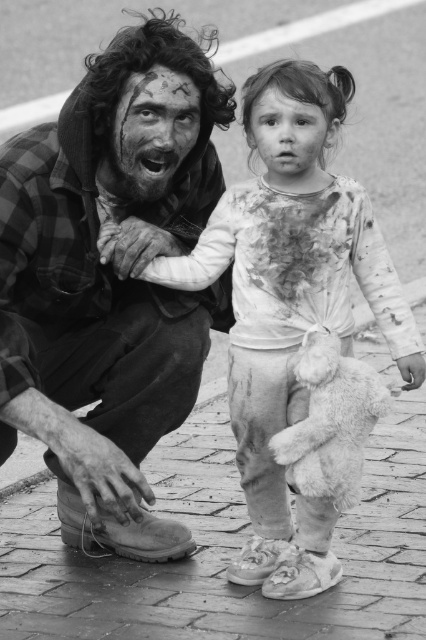
Looking at this image, is white cotton shirt at center to the left of dirty skin face at center from the viewer's perspective?

In fact, white cotton shirt at center is to the right of dirty skin face at center.

Is white cotton shirt at center wider than dirty skin face at center?

Yes.

Identify the location of white cotton shirt at center. This screenshot has width=426, height=640. (290, 323).

Which is behind, point (331, 456) or point (161, 144)?

The point (161, 144) is more distant.

Is fluffy white teddy bear at lower center positioned before dirty skin face at center?

That is True.

Who is more distant from viewer, (287,445) or (123,145)?

The point (123,145) is behind.

Locate an element on the screen. This screenshot has width=426, height=640. fluffy white teddy bear at lower center is located at coordinates (331, 420).

Does fluffy white teddy bear at lower center appear on the right side of dirty white face at center?

Indeed, fluffy white teddy bear at lower center is positioned on the right side of dirty white face at center.

Does point (314, 435) lie behind point (261, 120)?

No, it is in front of (261, 120).

Image resolution: width=426 pixels, height=640 pixels. Identify the location of fluffy white teddy bear at lower center. (331, 420).